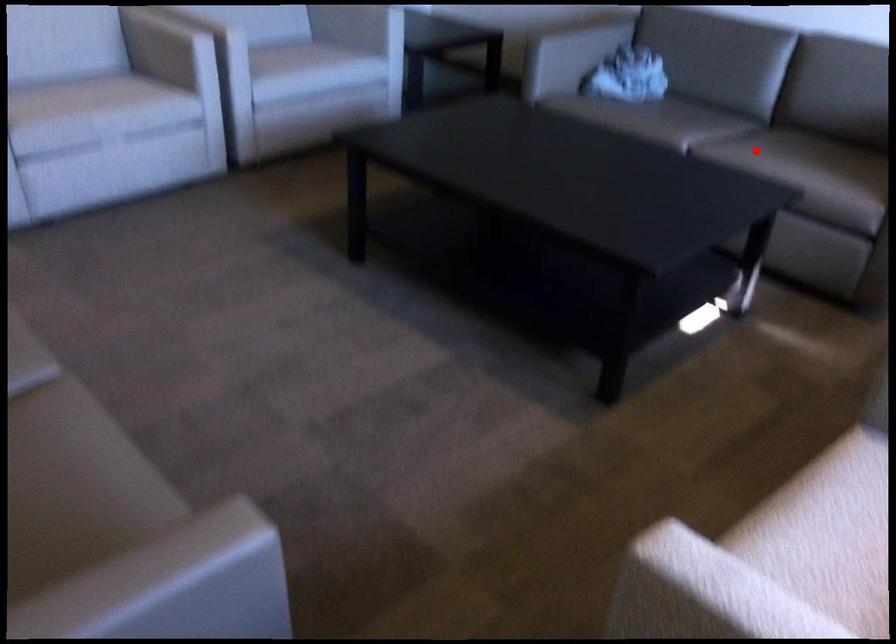
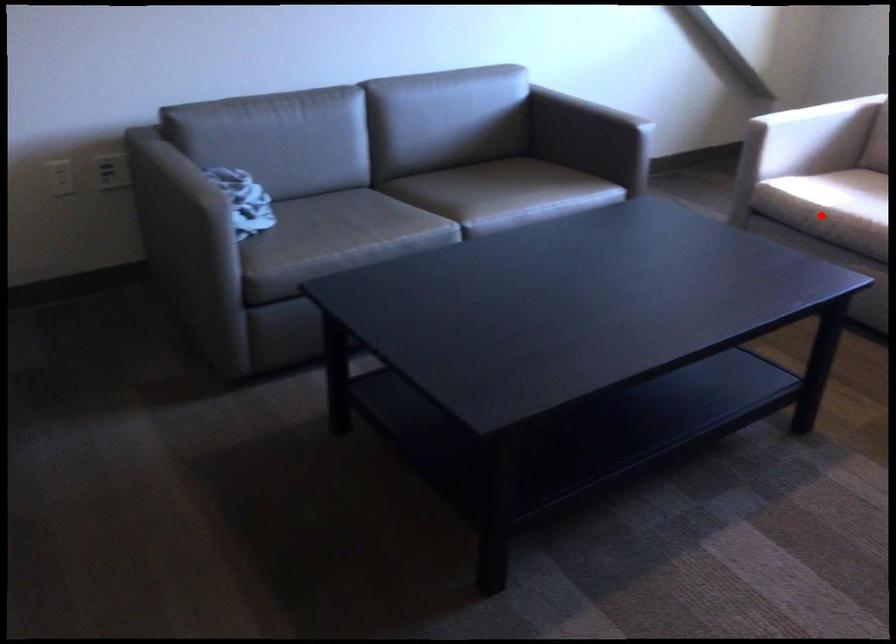
I am providing you with two images of the same scene from different viewpoints. A red point is marked on the first image and another point is marked on the second image. Is the red point in image1 aligned with the point shown in image2?

No